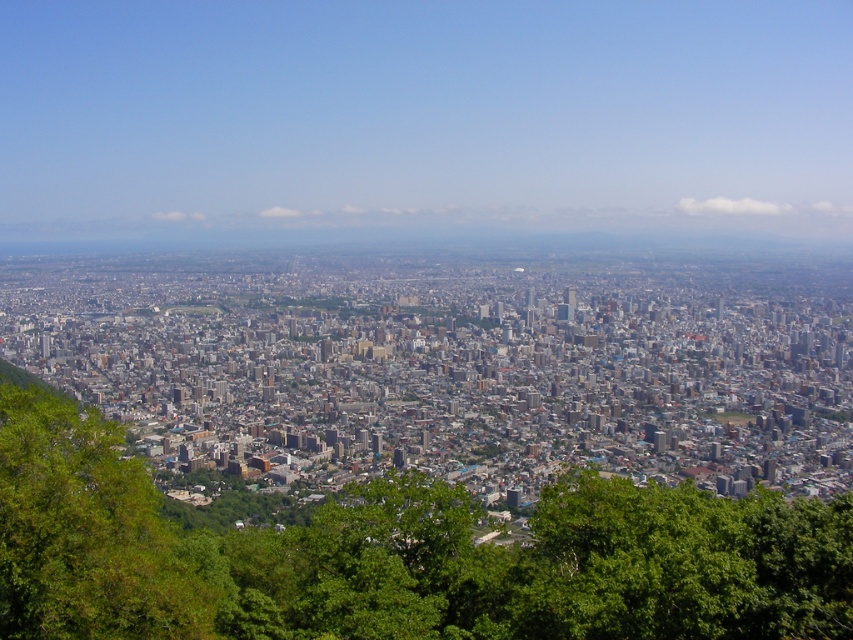
Consider the image. You are standing in the foreground of the urban landscape and see the green leafy tree at center and the green leafy tree at lower left. Which tree is positioned to the right side of the other?

The green leafy tree at center is to the right of the green leafy tree at lower left.

Consider the image. You are standing at the point marked by the coordinates point [97,621] in the image. A friend is at the same elevation as you and wants to know how far you are from them. What do you tell them?

The distance between point [97,621] and the viewer is 652.55 meters, so you are 652.55 meters away from your friend.

You are an urban planner reviewing this city layout. You notice the green leafy tree at center and the green leafy tree at lower left. Which tree is closer to the viewer based on their spatial arrangement?

The green leafy tree at center is closer to the viewer because it is positioned in front of the green leafy tree at lower left.